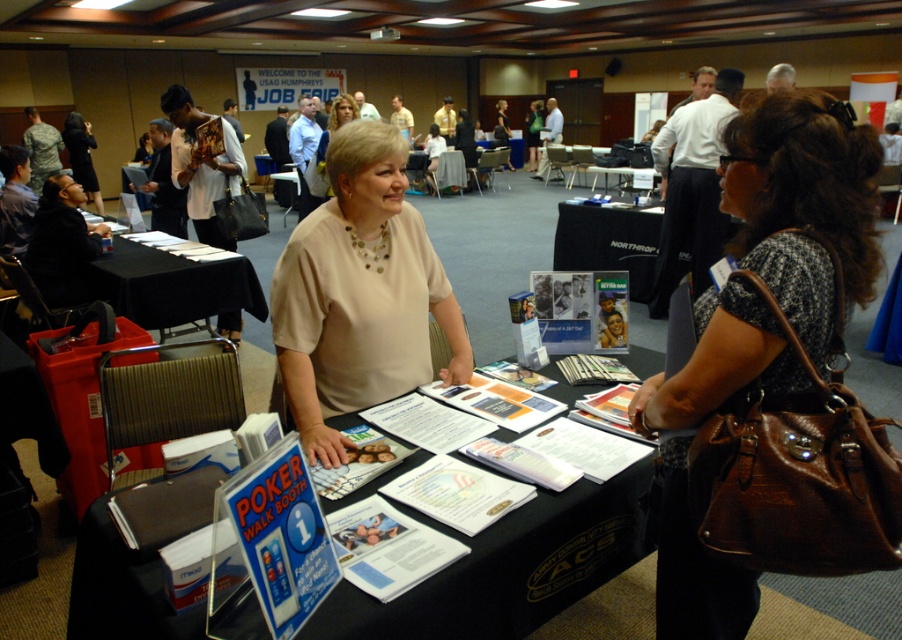
Question: Is black paper at center below black fabric table at center?

Choices:
 (A) yes
 (B) no

Answer: (A)

Question: Which point appears farthest from the camera in this image?

Choices:
 (A) (191, 264)
 (B) (327, 138)
 (C) (643, 284)
 (D) (630, 180)

Answer: (D)

Question: Does black paper at left appear on the right side of black plastic table at center?

Choices:
 (A) no
 (B) yes

Answer: (A)

Question: Does black fabric table at center appear on the left side of matte beige blouse at center?

Choices:
 (A) no
 (B) yes

Answer: (A)

Question: Which point appears farthest from the camera in this image?

Choices:
 (A) (132, 256)
 (B) (604, 179)
 (C) (582, 248)

Answer: (B)

Question: Among these objects, which one is farthest from the camera?

Choices:
 (A) brown leather purse at center
 (B) black fabric table at center

Answer: (B)